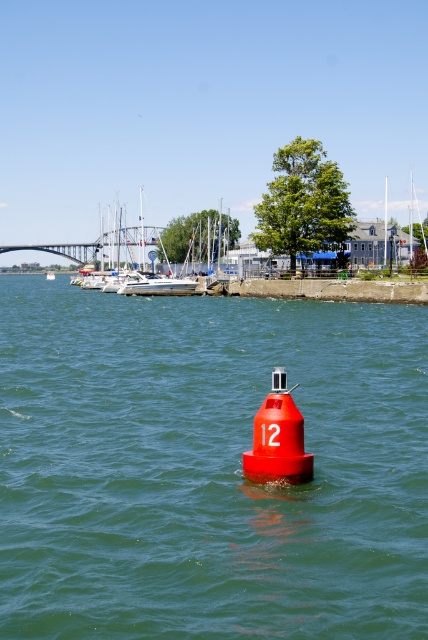
Consider the image. You are a boat operator who needs to navigate between the smooth glossy buoy at center and the white plastic boat at center. Given that your boat requires a minimum of 500 feet of space to maneuver safely, is there enough space between them?

The smooth glossy buoy at center is 511.68 feet away from the white plastic boat at center, so yes, there is enough space for the boat to maneuver safely between them since the distance exceeds the required 500 feet.

You are standing on the pier and see the smooth glossy buoy at center and the white plastic boat at center. Which object is positioned to the right of the other?

The smooth glossy buoy at center is to the right of the white plastic boat at center.

You are a marine biologist studying water currents. You need to place a sensor on the object with the larger width between the smooth glossy buoy at center and the white plastic boat at center. Which object should you choose?

The smooth glossy buoy at center has a larger width than the white plastic boat at center, so you should place the sensor on the smooth glossy buoy at center.